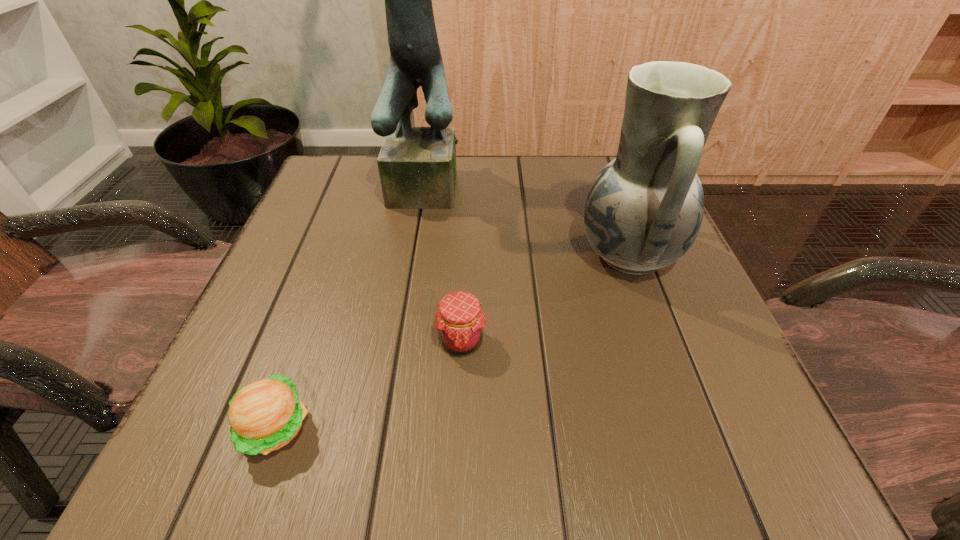
Find the location of a particular element. Image resolution: width=960 pixels, height=540 pixels. vacant space at the right edge of the desktop is located at coordinates (653, 272).

Locate an element on the screen. Image resolution: width=960 pixels, height=540 pixels. vacant space at the far left corner of the desktop is located at coordinates (375, 168).

At what (x,y) coordinates should I click in order to perform the action: click on free spot between the third farthest object and the pitcher. Please return your answer as a coordinate pair (x, y). Looking at the image, I should click on 545,298.

Identify the location of free point between the hamburger and the second nearest object. Image resolution: width=960 pixels, height=540 pixels. (368, 384).

Identify the location of vacant space that's between the leftmost object and the jam. The width and height of the screenshot is (960, 540). (368, 384).

The width and height of the screenshot is (960, 540). What are the coordinates of `vacant point located between the third farthest object and the pitcher` in the screenshot? It's located at (545, 298).

Identify the location of free spot between the third farthest object and the hamburger. This screenshot has height=540, width=960. (368, 384).

Where is `free space between the second nearest object and the pitcher`? free space between the second nearest object and the pitcher is located at coordinates 545,298.

Locate an element on the screen. Image resolution: width=960 pixels, height=540 pixels. free space between the leftmost object and the jam is located at coordinates (368, 384).

Identify the location of vacant area between the farthest object and the hamburger. This screenshot has width=960, height=540. (354, 306).